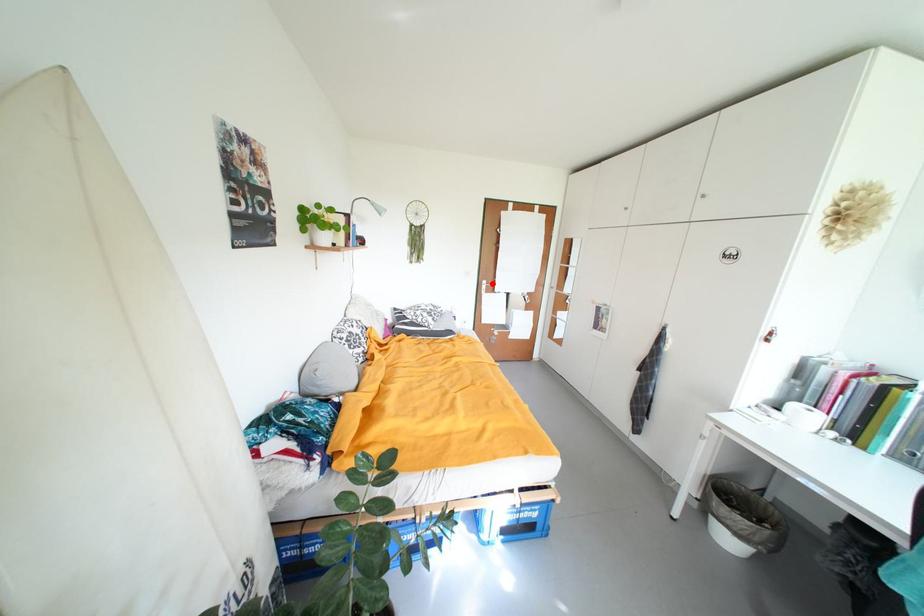
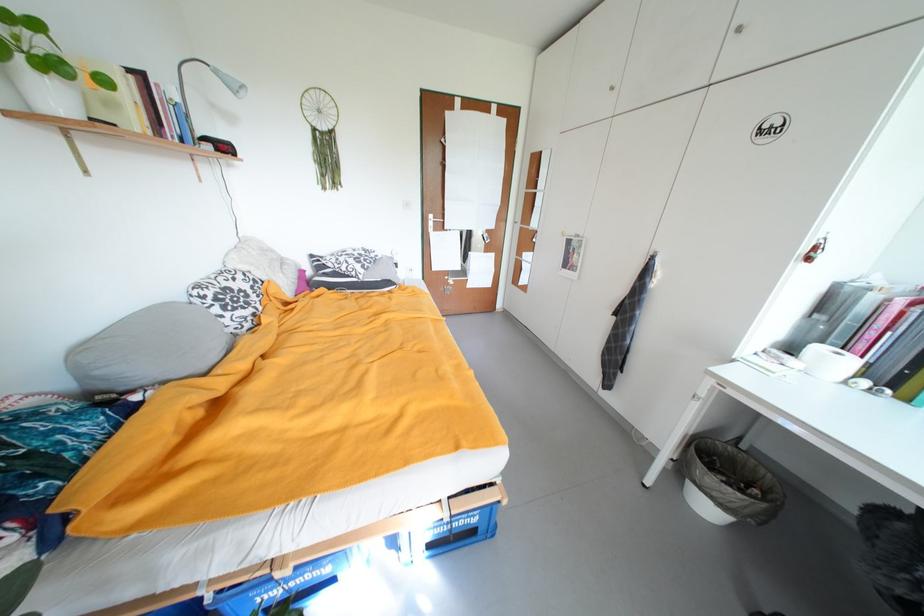
Locate, in the second image, the point that corresponds to the highlighted location in the first image.

(439, 217)